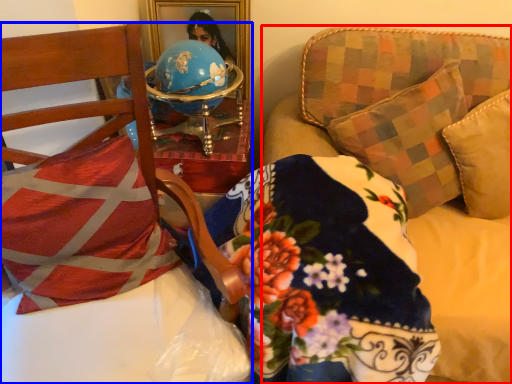
Question: Which object is further to the camera taking this photo, studio couch (highlighted by a red box) or furniture (highlighted by a blue box)?

Choices:
 (A) studio couch
 (B) furniture

Answer: (A)